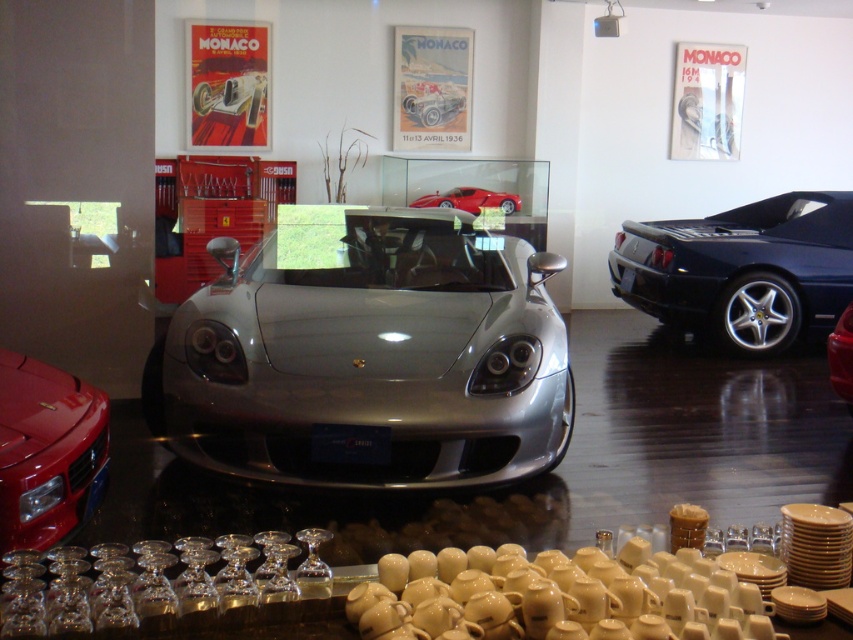
Looking at this image, can you confirm if shiny red ferrari at lower left is shorter than shiny black sports car at right?

Yes, shiny red ferrari at lower left is shorter than shiny black sports car at right.

Can you confirm if shiny red ferrari at lower left is wider than shiny black sports car at right?

Correct, the width of shiny red ferrari at lower left exceeds that of shiny black sports car at right.

What do you see at coordinates (47, 451) in the screenshot? I see `shiny red ferrari at lower left` at bounding box center [47, 451].

Locate an element on the screen. The image size is (853, 640). shiny red ferrari at lower left is located at coordinates (47, 451).

Is silver metallic sports car at center to the left of shiny red sports car at center from the viewer's perspective?

Indeed, silver metallic sports car at center is positioned on the left side of shiny red sports car at center.

Can you confirm if silver metallic sports car at center is positioned above shiny red sports car at center?

Incorrect, silver metallic sports car at center is not positioned above shiny red sports car at center.

This screenshot has width=853, height=640. Describe the element at coordinates (372, 355) in the screenshot. I see `silver metallic sports car at center` at that location.

The height and width of the screenshot is (640, 853). What are the coordinates of `silver metallic sports car at center` in the screenshot? It's located at (372, 355).

Between shiny black sports car at right and shiny red sports car at center, which one appears on the right side from the viewer's perspective?

shiny black sports car at right is more to the right.

Between shiny black sports car at right and shiny red sports car at center, which one has more height?

Answer: With more height is shiny black sports car at right.

At what (x,y) coordinates should I click in order to perform the action: click on shiny black sports car at right. Please return your answer as a coordinate pair (x, y). Image resolution: width=853 pixels, height=640 pixels. Looking at the image, I should click on (840, 356).

Locate an element on the screen. shiny black sports car at right is located at coordinates (840, 356).